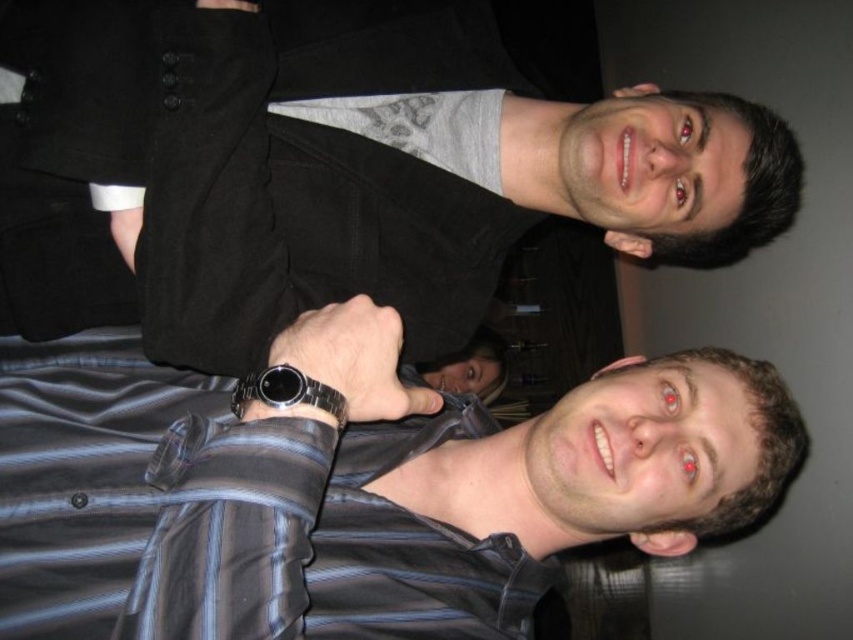
Locate an element on the screen. black matte shirt at upper center is located at coordinates (350, 164).

Does point (171, 29) come farther from viewer compared to point (107, 403)?

No, it is in front of (107, 403).

Between point (630, 180) and point (515, 426), which one is positioned in front?

Point (630, 180) is more forward.

Locate an element on the screen. black matte shirt at upper center is located at coordinates (350, 164).

Does striped fabric shirt at lower left have a lesser height compared to sleek metal watch at center?

Incorrect, striped fabric shirt at lower left's height does not fall short of sleek metal watch at center's.

Which is above, striped fabric shirt at lower left or sleek metal watch at center?

Positioned higher is sleek metal watch at center.

Locate an element on the screen. This screenshot has height=640, width=853. striped fabric shirt at lower left is located at coordinates (350, 486).

Between point (172, 4) and point (262, 369), which one is positioned behind?

Positioned behind is point (172, 4).

Measure the distance from black matte shirt at upper center to sleek metal watch at center.

black matte shirt at upper center and sleek metal watch at center are 12.12 inches apart.

Describe the element at coordinates (350, 164) in the screenshot. I see `black matte shirt at upper center` at that location.

You are a GUI agent. You are given a task and a screenshot of the screen. Output one action in this format:
    pyautogui.click(x=<x>, y=<y>)
    Task: Click on the black matte shirt at upper center
    
    Given the screenshot: What is the action you would take?
    pyautogui.click(x=350, y=164)